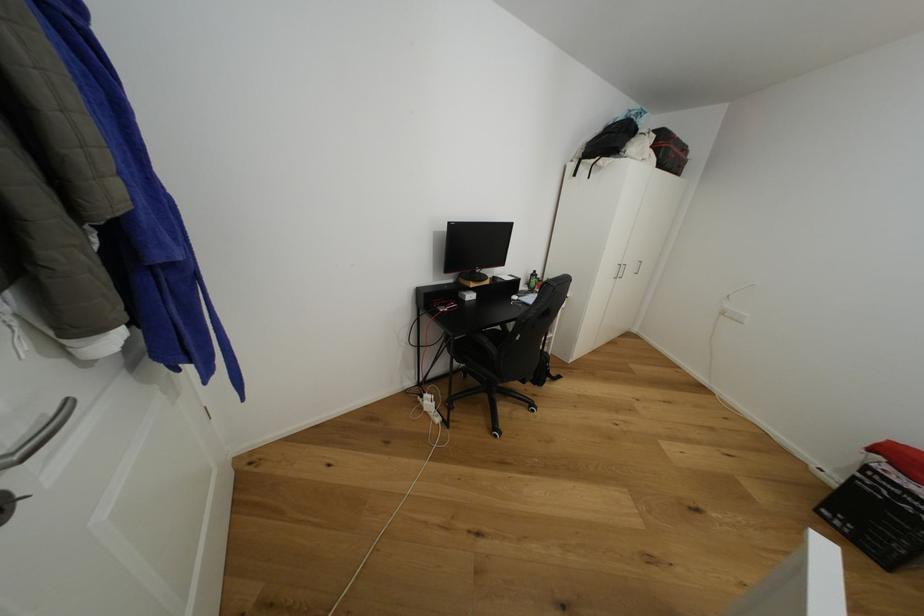
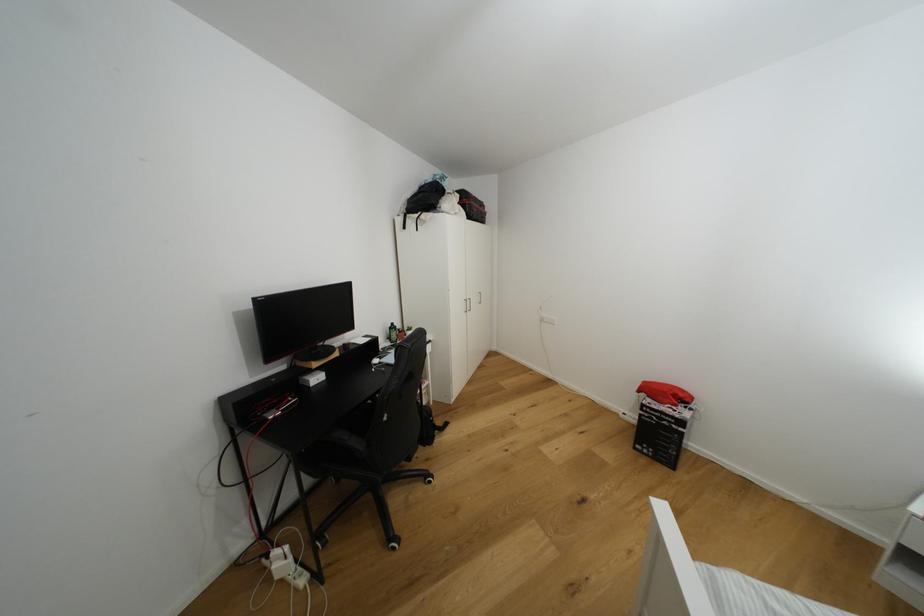
The point at [558,374] is marked in the first image. Where is the corresponding point in the second image?

(444, 424)